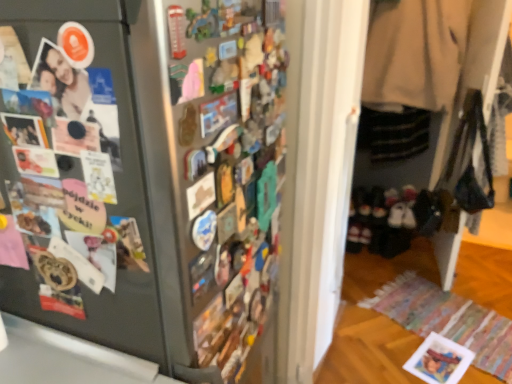
Question: Is satin black fridge at left at the left side of matte black photo at left?

Choices:
 (A) yes
 (B) no

Answer: (B)

Question: From a real-world perspective, is satin black fridge at left on top of matte black photo at left?

Choices:
 (A) yes
 (B) no

Answer: (B)

Question: Does satin black fridge at left have a lesser width compared to matte black photo at left?

Choices:
 (A) no
 (B) yes

Answer: (A)

Question: Is satin black fridge at left in front of matte black photo at left?

Choices:
 (A) yes
 (B) no

Answer: (A)

Question: Is satin black fridge at left positioned with its back to matte black photo at left?

Choices:
 (A) no
 (B) yes

Answer: (A)

Question: In the image, is beige wool coat at right positioned in front of or behind black suede shoes at lower right?

Choices:
 (A) behind
 (B) front

Answer: (B)

Question: Is point (403, 38) closer or farther from the camera than point (387, 205)?

Choices:
 (A) farther
 (B) closer

Answer: (B)

Question: From a real-world perspective, relative to black suede shoes at lower right, is beige wool coat at right vertically above or below?

Choices:
 (A) below
 (B) above

Answer: (B)

Question: Based on their positions, is beige wool coat at right located to the left or right of black suede shoes at lower right?

Choices:
 (A) right
 (B) left

Answer: (A)

Question: Is satin black fridge at left inside the boundaries of black suede shoes at lower right, or outside?

Choices:
 (A) outside
 (B) inside

Answer: (A)

Question: From the image's perspective, relative to black suede shoes at lower right, is satin black fridge at left above or below?

Choices:
 (A) below
 (B) above

Answer: (A)

Question: In terms of height, does satin black fridge at left look taller or shorter compared to black suede shoes at lower right?

Choices:
 (A) tall
 (B) short

Answer: (A)

Question: From a real-world perspective, is satin black fridge at left physically located above or below black suede shoes at lower right?

Choices:
 (A) above
 (B) below

Answer: (A)

Question: In the image, is matte black photo at left positioned in front of or behind beige wool coat at right?

Choices:
 (A) behind
 (B) front

Answer: (B)

Question: Looking at the image, does matte black photo at left seem bigger or smaller compared to beige wool coat at right?

Choices:
 (A) small
 (B) big

Answer: (A)